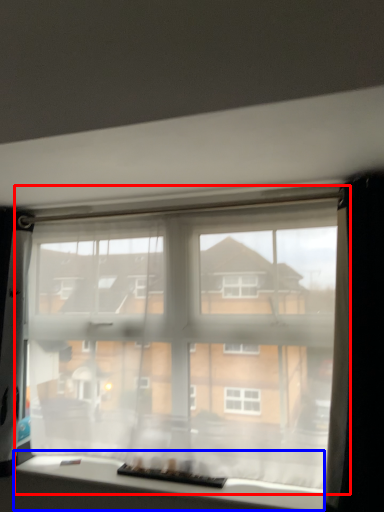
Question: Among these objects, which one is nearest to the camera, window (highlighted by a red box) or window (highlighted by a blue box)?

Choices:
 (A) window
 (B) window

Answer: (B)